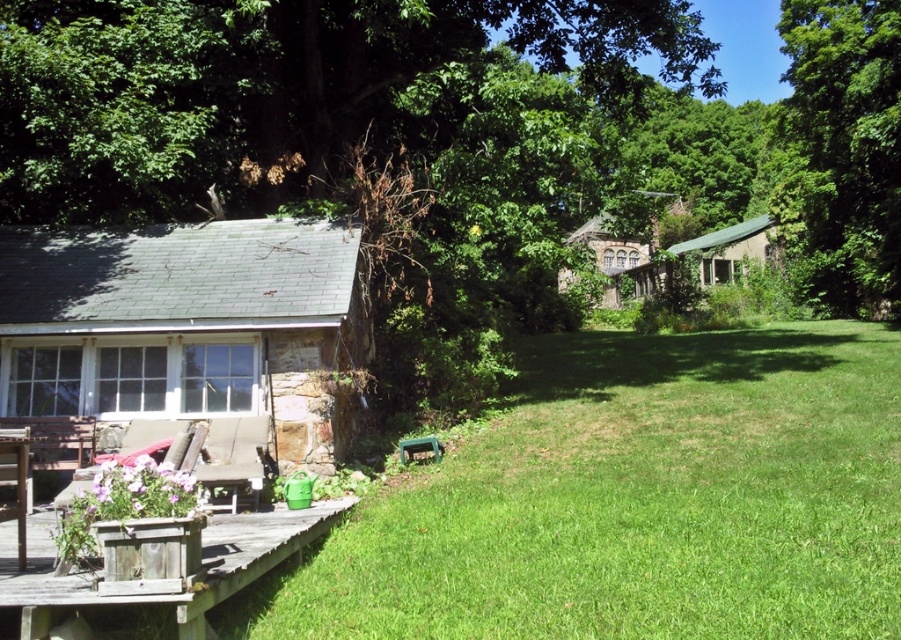
You are standing at the edge of the wooden deck in the backyard scene. There are two points marked in the image, one at coordinates point (269,360) and another at point (578,237). Which of these points is closer to your current position?

Point (269,360) is closer to the camera than point (578,237), so the point at coordinates point (269,360) is closer to your current position on the wooden deck.

In the scene shown: You are a painter who wants to paint both the white stone cottage at left and the rustic stone cottage at center. Which cottage should you bring more paint for, and why?

You should bring more paint for the rustic stone cottage at center because it is larger than the white stone cottage at left.

Based on the photo, you are standing at the edge of the wooden deck in the backyard scene. You notice two points marked in the image. The first point is at coordinates point (874, 548), and the second is at point (702, 273). From your current position, which point is closer to you?

Point (874, 548) is in front of point (702, 273), so the first point is closer to you.